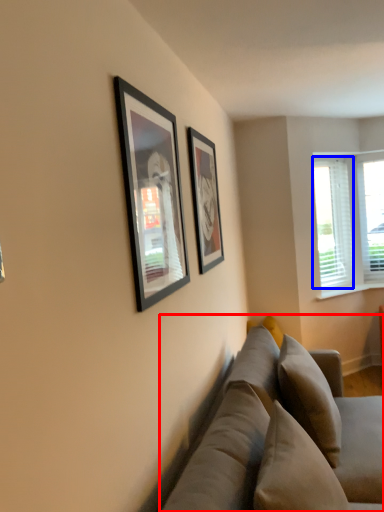
Question: Which of the following is the closest to the observer, studio couch (highlighted by a red box) or window screen (highlighted by a blue box)?

Choices:
 (A) studio couch
 (B) window screen

Answer: (A)